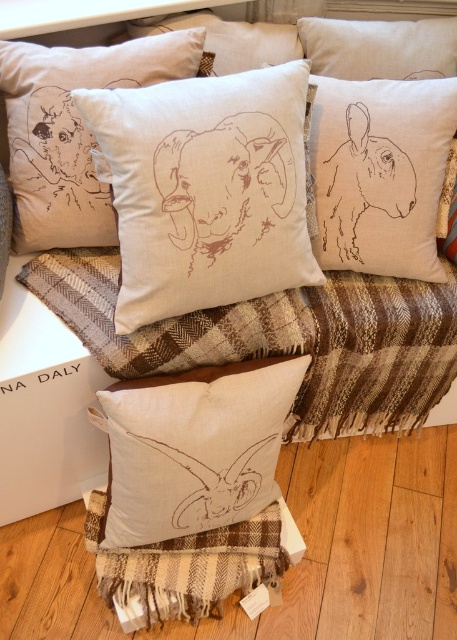
Does natural linen cushion at center have a greater width compared to brown textured rabbit at upper right?

→ Indeed, natural linen cushion at center has a greater width compared to brown textured rabbit at upper right.

You are a GUI agent. You are given a task and a screenshot of the screen. Output one action in this format:
    pyautogui.click(x=<x>, y=<y>)
    Task: Click on the natural linen cushion at center
    
    Given the screenshot: What is the action you would take?
    pyautogui.click(x=205, y=188)

How much distance is there between brown woven blanket at center and brown textured rabbit at upper right?

10.48 inches

Locate an element on the screen. The height and width of the screenshot is (640, 457). brown woven blanket at center is located at coordinates pos(280,339).

Does point (403, 374) come in front of point (405, 193)?

No, it is not.

You are a GUI agent. You are given a task and a screenshot of the screen. Output one action in this format:
    pyautogui.click(x=<x>, y=<y>)
    Task: Click on the brown woven blanket at center
    
    Given the screenshot: What is the action you would take?
    coord(280,339)

Does brown plaid blanket at lower center lie behind beige linen cushion at center?

Yes.

Which is above, brown plaid blanket at lower center or beige linen cushion at center?

Positioned higher is beige linen cushion at center.

Who is more forward, (164, 541) or (218, 33)?

Positioned in front is point (164, 541).

At what (x,y) coordinates should I click in order to perform the action: click on brown plaid blanket at lower center. Please return your answer as a coordinate pair (x, y). Looking at the image, I should click on (187, 566).